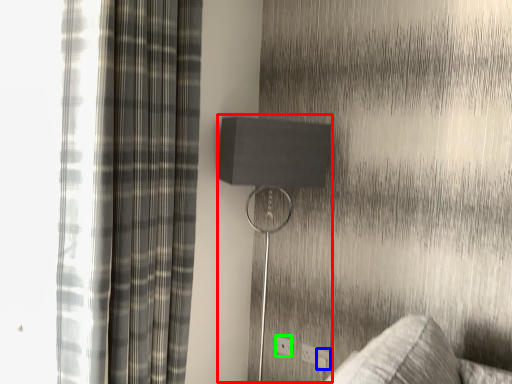
Question: Which object is the closest to the table lamp (highlighted by a red box)? Choose among these: electric outlet (highlighted by a blue box) or electric outlet (highlighted by a green box).

Choices:
 (A) electric outlet
 (B) electric outlet

Answer: (B)